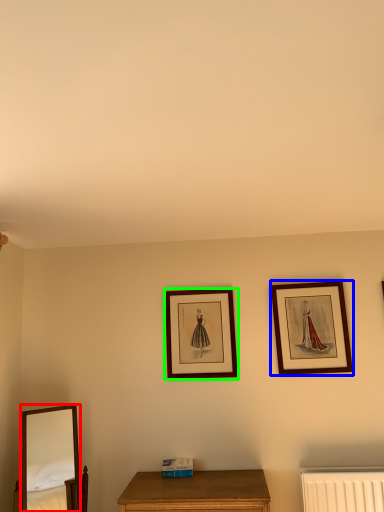
Question: Which object is the farthest from mirror (highlighted by a red box)? Choose among these: picture frame (highlighted by a blue box) or picture frame (highlighted by a green box).

Choices:
 (A) picture frame
 (B) picture frame

Answer: (A)